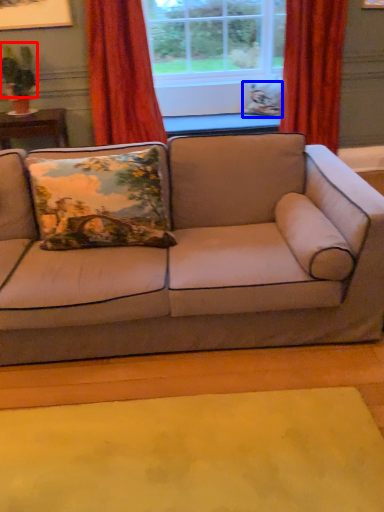
Question: Which of the following is the closest to the observer, plant (highlighted by a red box) or pillow (highlighted by a blue box)?

Choices:
 (A) plant
 (B) pillow

Answer: (A)